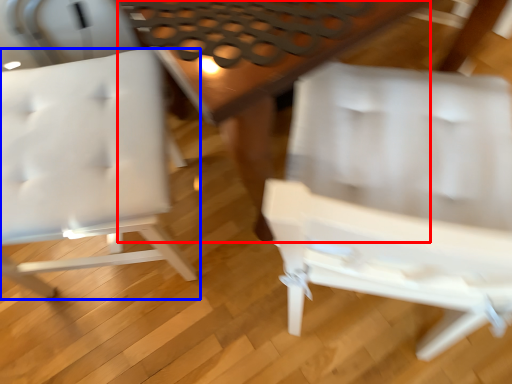
Question: Among these objects, which one is nearest to the camera, table (highlighted by a red box) or chair (highlighted by a blue box)?

Choices:
 (A) table
 (B) chair

Answer: (B)